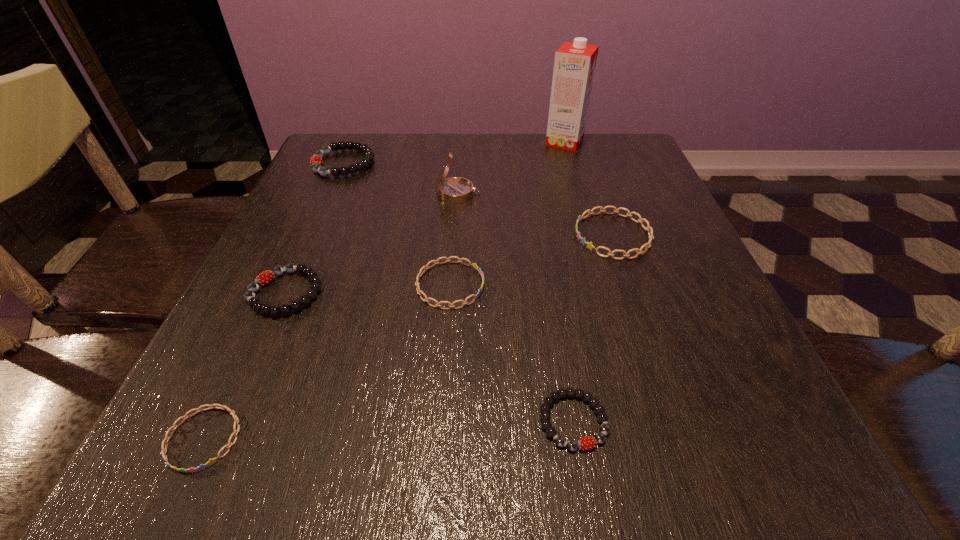
Locate an element on the screen. The width and height of the screenshot is (960, 540). carton is located at coordinates (574, 66).

This screenshot has height=540, width=960. In order to click on the second tallest object in this screenshot , I will do `click(455, 190)`.

This screenshot has width=960, height=540. In order to click on compass in this screenshot , I will do `click(455, 190)`.

I want to click on the sixth shortest object, so click(316, 160).

The height and width of the screenshot is (540, 960). Find the location of `the farthest bracelet`. the farthest bracelet is located at coordinates (316, 160).

Find the location of a particular element. the rightmost bracelet is located at coordinates (589, 245).

At what (x,y) coordinates should I click in order to perform the action: click on the second farthest bracelet. Please return your answer as a coordinate pair (x, y). Image resolution: width=960 pixels, height=540 pixels. Looking at the image, I should click on (589, 245).

Where is `the second smallest black bracelet`? Image resolution: width=960 pixels, height=540 pixels. the second smallest black bracelet is located at coordinates (266, 277).

The width and height of the screenshot is (960, 540). Identify the location of the second smallest blue bracelet. (475, 266).

Identify the location of the second nearest blue bracelet. (475, 266).